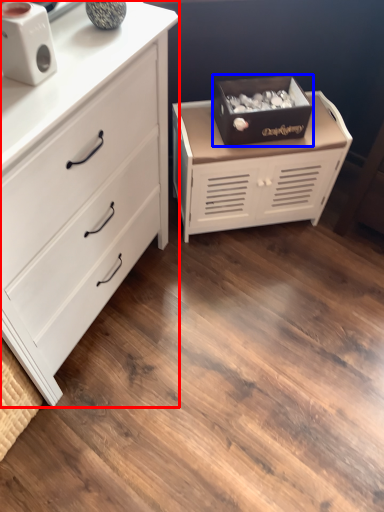
Question: Which object appears farthest to the camera in this image, chest of drawers (highlighted by a red box) or storage box (highlighted by a blue box)?

Choices:
 (A) chest of drawers
 (B) storage box

Answer: (B)